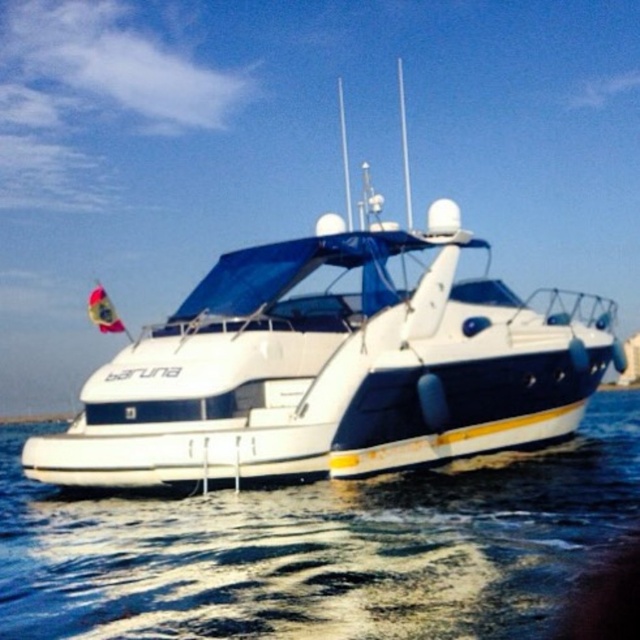
Question: Is white glossy boat at center behind white smooth water at lower center?

Choices:
 (A) no
 (B) yes

Answer: (B)

Question: Is white glossy boat at center wider than white smooth water at lower center?

Choices:
 (A) yes
 (B) no

Answer: (B)

Question: Which object is closer to the camera taking this photo?

Choices:
 (A) white smooth water at lower center
 (B) white glossy boat at center

Answer: (A)

Question: Is white glossy boat at center to the left of white smooth water at lower center from the viewer's perspective?

Choices:
 (A) no
 (B) yes

Answer: (A)

Question: Which point is farther from the camera taking this photo?

Choices:
 (A) (232, 529)
 (B) (376, 298)

Answer: (B)